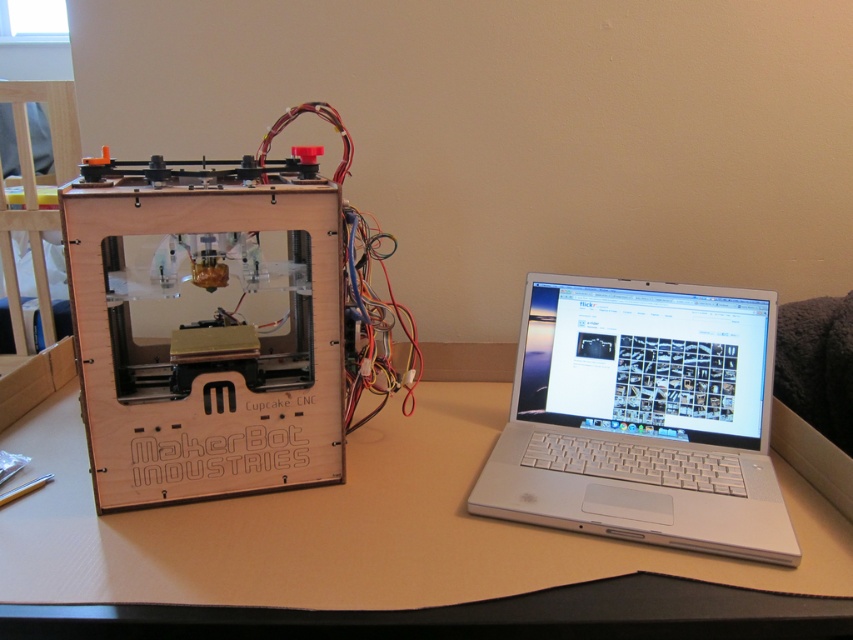
Question: Is light brown wood table at center to the left of silver metallic laptop at center from the viewer's perspective?

Choices:
 (A) yes
 (B) no

Answer: (A)

Question: Among these points, which one is farthest from the camera?

Choices:
 (A) (349, 561)
 (B) (541, 509)

Answer: (B)

Question: Is light brown wood table at center thinner than silver metallic laptop at center?

Choices:
 (A) yes
 (B) no

Answer: (B)

Question: Can you confirm if light brown wood table at center is positioned to the left of silver metallic laptop at center?

Choices:
 (A) yes
 (B) no

Answer: (A)